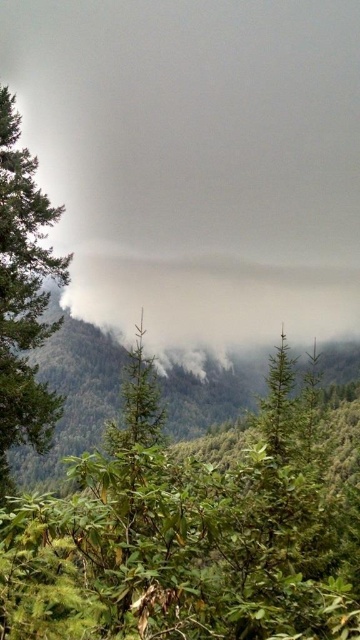
You are a hiker who wants to take a photo of the green leafy tree at center and the green matte tree at left. Which tree should you stand closer to in order to capture both in a single frame without zooming?

You should stand closer to the green leafy tree at center because it is wider than the green matte tree at left, so positioning yourself closer to the wider tree allows both to fit within the camera frame without zooming.

You are standing in the forest and want to move from the point at coordinates point (177, 58) to the point at coordinates point (11, 196). Which direction should you move to get closer to your destination?

To move from point (177, 58) to point (11, 196), you should move downward and to the right because point (177, 58) is further away from you than point (11, 196).